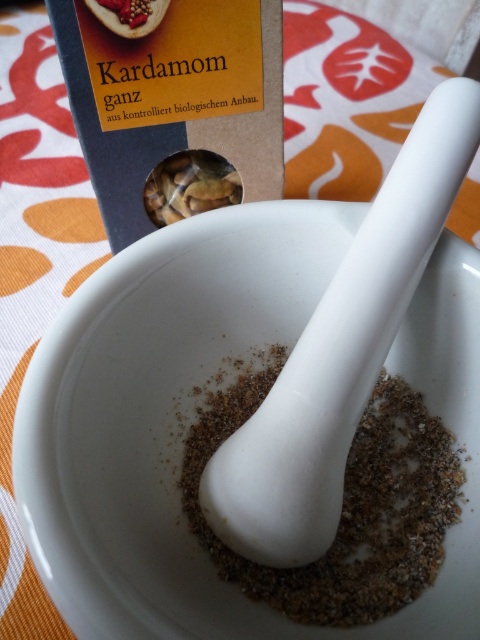
Question: Which point appears farthest from the camera in this image?

Choices:
 (A) (217, 164)
 (B) (152, 6)

Answer: (A)

Question: Which is nearer to the brown matte cardamom at upper left?

Choices:
 (A) brown matte almonds at center
 (B) white matte mortar and pestle at center

Answer: (A)

Question: Which of these objects is positioned closest to the brown matte cardamom at upper left?

Choices:
 (A) white matte mortar and pestle at center
 (B) brown matte almonds at center

Answer: (B)

Question: Can you confirm if white matte mortar and pestle at center is bigger than brown matte almonds at center?

Choices:
 (A) yes
 (B) no

Answer: (A)

Question: Is white matte mortar and pestle at center bigger than brown matte cardamom at upper left?

Choices:
 (A) no
 (B) yes

Answer: (B)

Question: Can you confirm if white matte mortar and pestle at center is positioned above brown matte almonds at center?

Choices:
 (A) no
 (B) yes

Answer: (A)